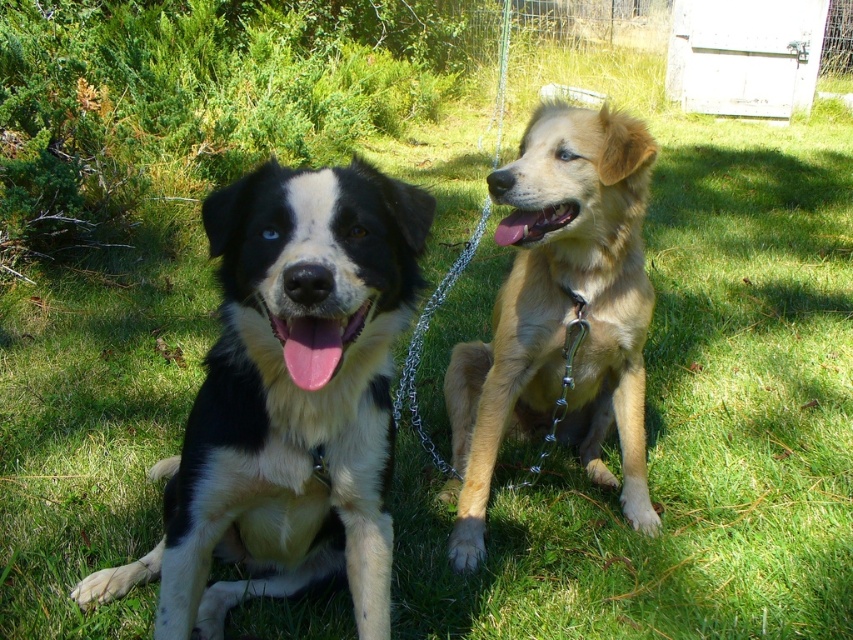
You are standing at the point marked by the coordinates point (289, 401). Looking around, you see two dogs. Which dog is directly in front of you?

The black and white fur dog at left is directly in front of you at point (289, 401).

You are a photographer trying to capture both dogs in a single shot. Since the black and white fur dog at left is below the golden fur dog at right, will you need to adjust your camera angle upward or downward to include both in the frame?

Since the black and white fur dog at left is below the golden fur dog at right, you will need to adjust your camera angle upward to ensure both are captured in the frame.

You are a dog trainer assessing the dogs in the image. You need to determine which dog is shorter between the black and white fur dog at left and the golden fur dog at right based on their height. Which one is shorter?

The black and white fur dog at left is not as tall as the golden fur dog at right, so the black and white fur dog at left is shorter.